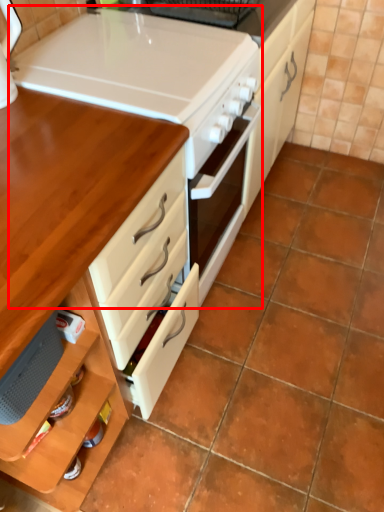
Question: Where is appliance (annotated by the red box) located in relation to table in the image?

Choices:
 (A) left
 (B) right

Answer: (B)